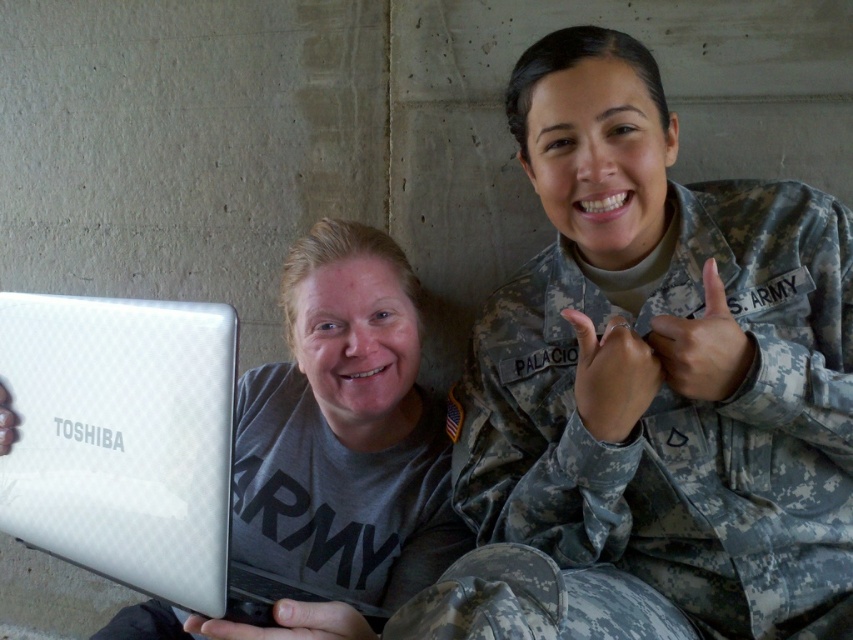
Does camouflage fabric us army uniform at upper right have a lesser height compared to silver textured laptop at center?

In fact, camouflage fabric us army uniform at upper right may be taller than silver textured laptop at center.

Image resolution: width=853 pixels, height=640 pixels. What are the coordinates of `camouflage fabric us army uniform at upper right` in the screenshot? It's located at (662, 445).

Between point (480, 572) and point (57, 556), which one is positioned behind?

Positioned behind is point (57, 556).

This screenshot has width=853, height=640. I want to click on camouflage fabric us army uniform at upper right, so click(x=662, y=445).